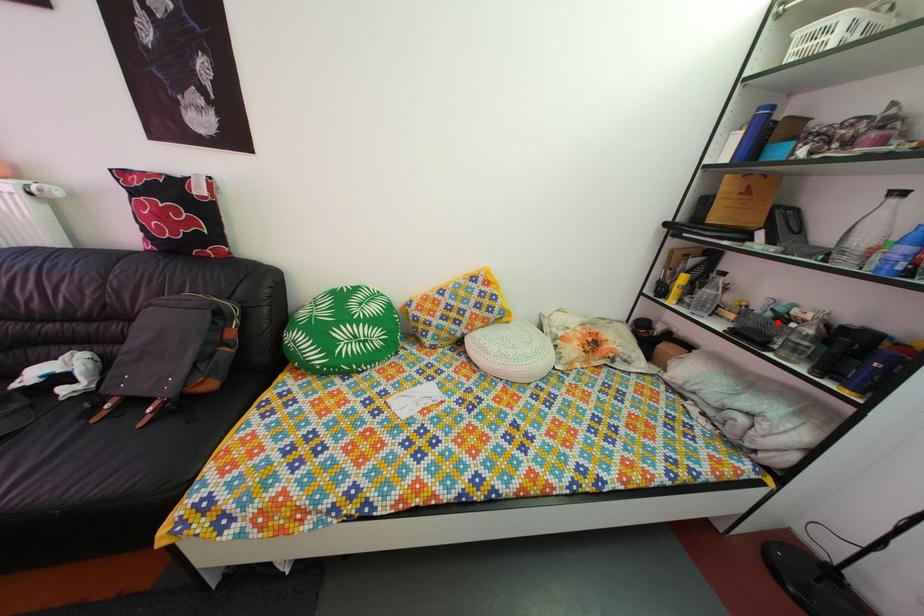
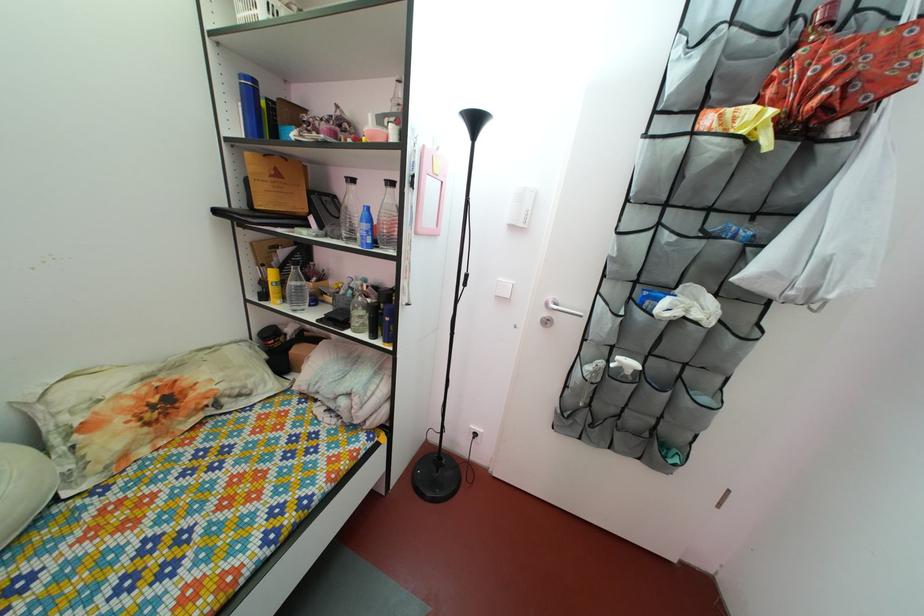
Find the pixel in the second image that matches the highlighted location in the first image.

(359, 301)